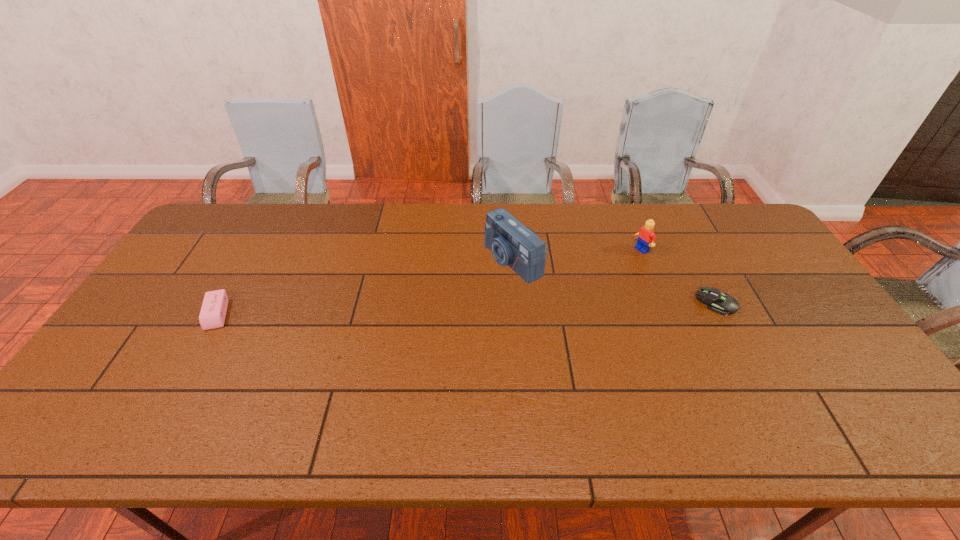
You are a GUI agent. You are given a task and a screenshot of the screen. Output one action in this format:
    pyautogui.click(x=<x>, y=<y>)
    Task: Click on the free spot between the Lego and the computer mouse
    
    Given the screenshot: What is the action you would take?
    pyautogui.click(x=679, y=276)

Identify the location of empty location between the Lego and the camera. Image resolution: width=960 pixels, height=540 pixels. (577, 255).

Where is `object that is the closest to the camera`? This screenshot has height=540, width=960. object that is the closest to the camera is located at coordinates (646, 235).

Locate an element on the screen. object that is the third nearest to the leftmost object is located at coordinates (723, 304).

The height and width of the screenshot is (540, 960). I want to click on vacant space that satisfies the following two spatial constraints: 1. on the back side of the camera; 2. on the left side of the third object from left to right, so click(x=512, y=249).

This screenshot has height=540, width=960. Find the location of `free location that satisfies the following two spatial constraints: 1. on the front side of the third object from right to left; 2. on the right side of the rightmost object`. free location that satisfies the following two spatial constraints: 1. on the front side of the third object from right to left; 2. on the right side of the rightmost object is located at coordinates (516, 303).